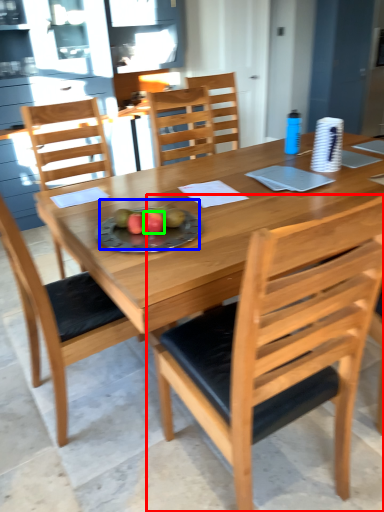
Question: Which object is positioned closest to chair (highlighted by a red box)? Select from fruit dish (highlighted by a blue box) and fruit (highlighted by a green box).

Choices:
 (A) fruit dish
 (B) fruit

Answer: (A)